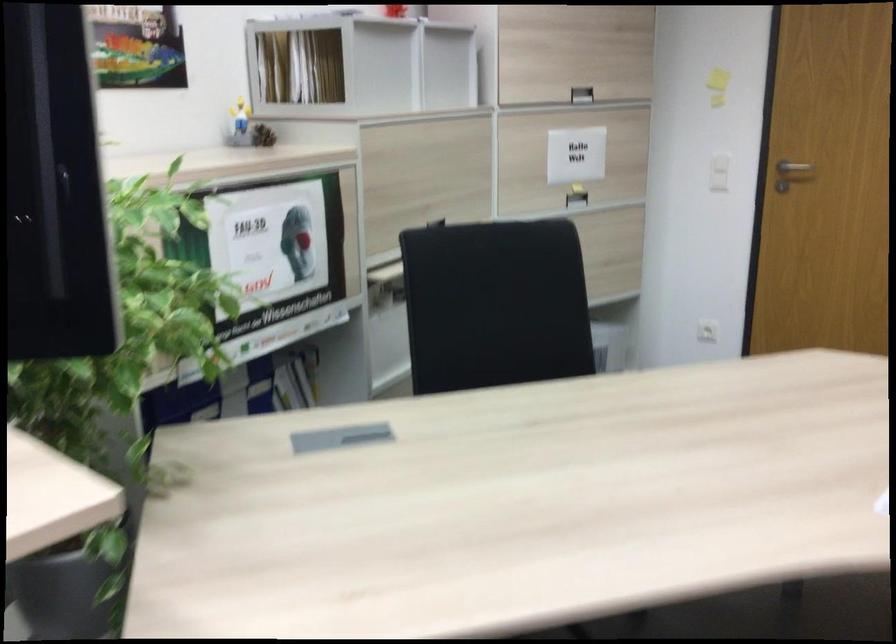
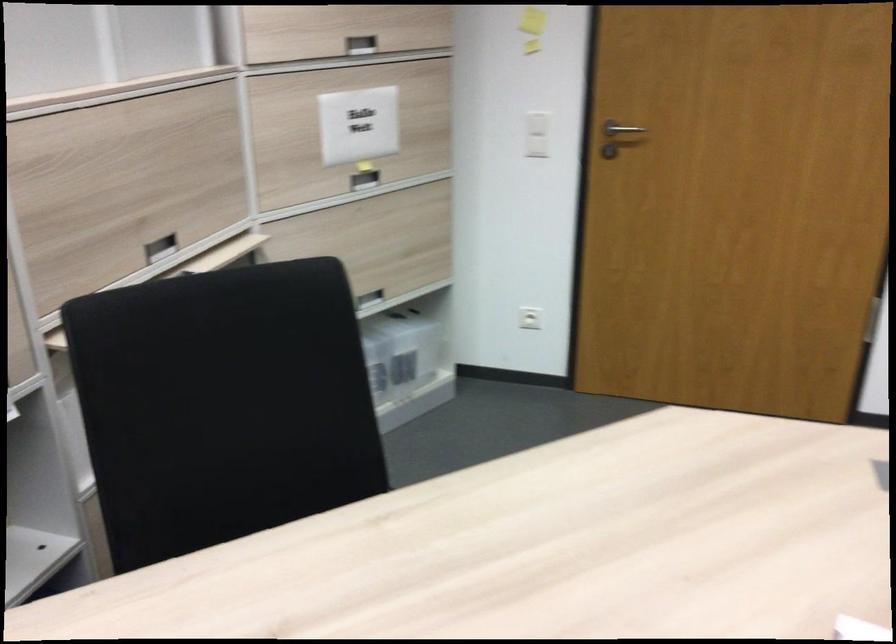
Where in the second image is the point corresponding to point (797, 166) from the first image?

(619, 129)